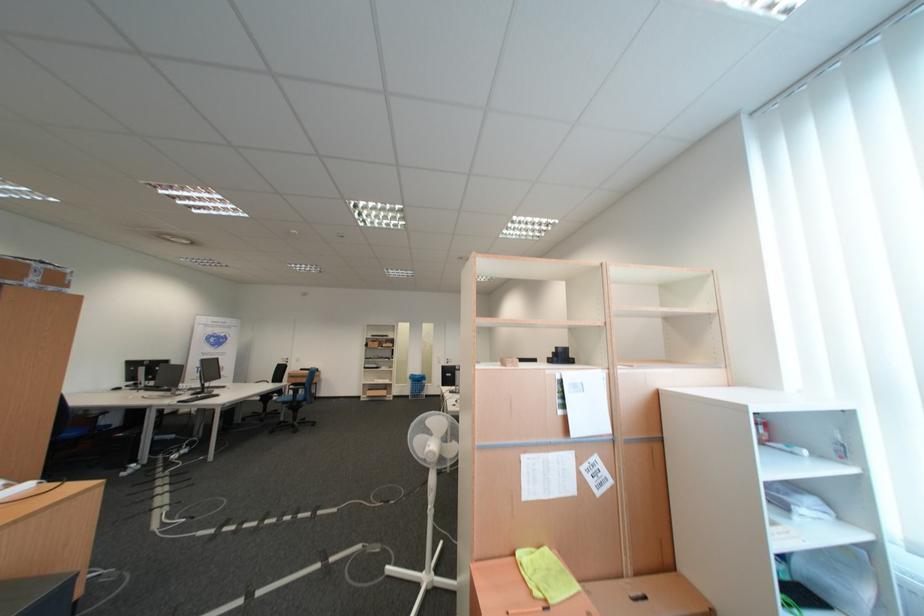
The location [545,573] corresponds to which object?

This point indicates the yellow cloth.